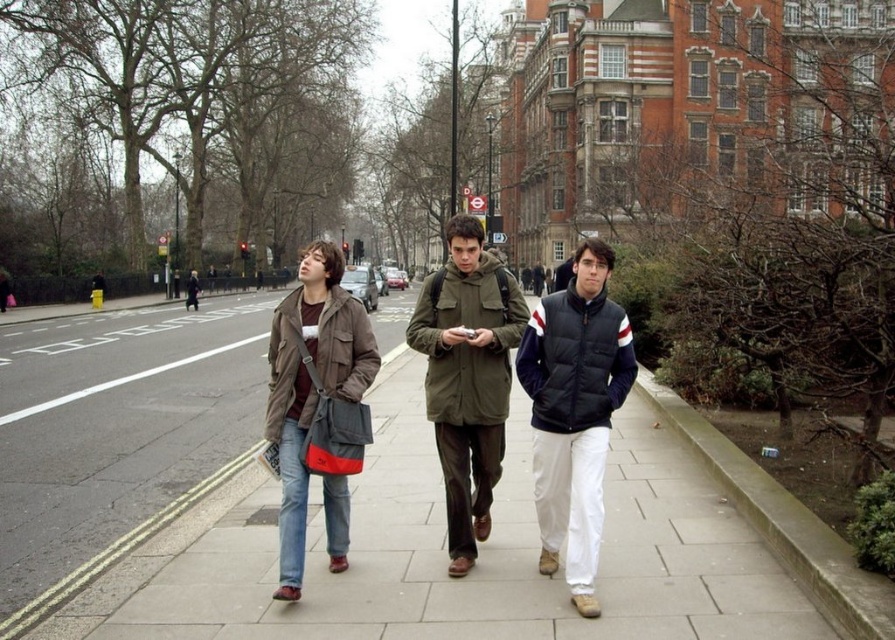
Which of these two, smooth concrete pavement at center or brown leather jacket at center, stands taller?

brown leather jacket at center

Does smooth concrete pavement at center appear over brown leather jacket at center?

Actually, smooth concrete pavement at center is below brown leather jacket at center.

The image size is (895, 640). What are the coordinates of `smooth concrete pavement at center` in the screenshot? It's located at (445, 552).

The image size is (895, 640). What are the coordinates of `smooth concrete pavement at center` in the screenshot? It's located at click(x=445, y=552).

Which of these two, dark blue puffer jacket at center or olive green canvas jacket at center, stands taller?

Standing taller between the two is olive green canvas jacket at center.

Can you confirm if dark blue puffer jacket at center is positioned above olive green canvas jacket at center?

Indeed, dark blue puffer jacket at center is positioned over olive green canvas jacket at center.

Is point (587, 484) less distant than point (493, 264)?

Yes, point (587, 484) is in front of point (493, 264).

This screenshot has width=895, height=640. In order to click on dark blue puffer jacket at center in this screenshot , I will do `click(574, 412)`.

Does brown leather jacket at center have a greater height compared to olive green canvas jacket at center?

Yes.

What do you see at coordinates (310, 385) in the screenshot? I see `brown leather jacket at center` at bounding box center [310, 385].

Image resolution: width=895 pixels, height=640 pixels. In order to click on brown leather jacket at center in this screenshot , I will do `click(310, 385)`.